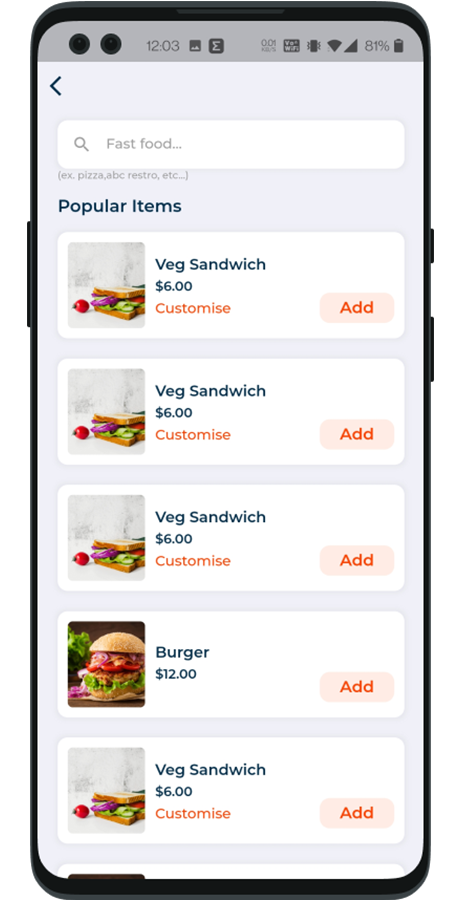
This screenshot has width=460, height=900. Find the location of `wifi`. wifi is located at coordinates (333, 47).